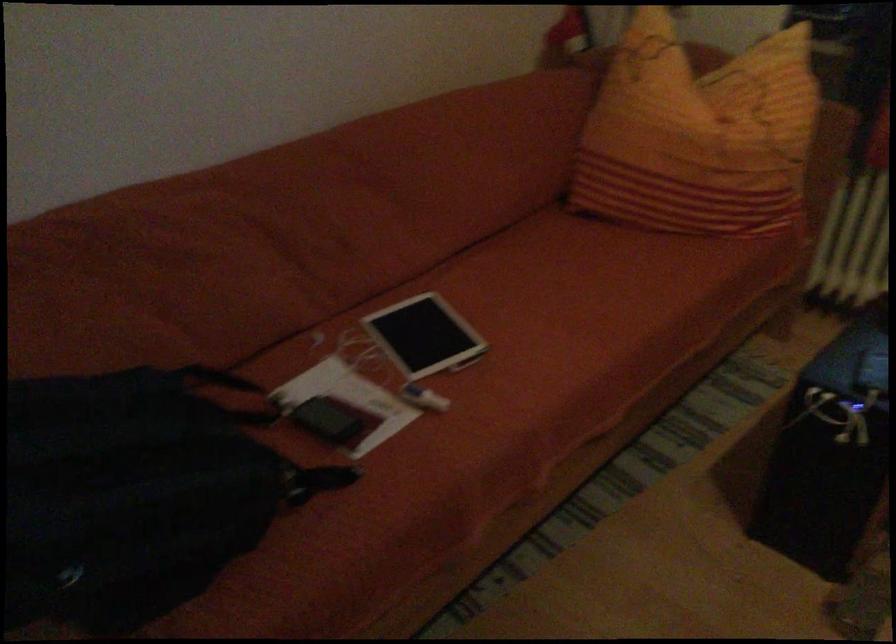
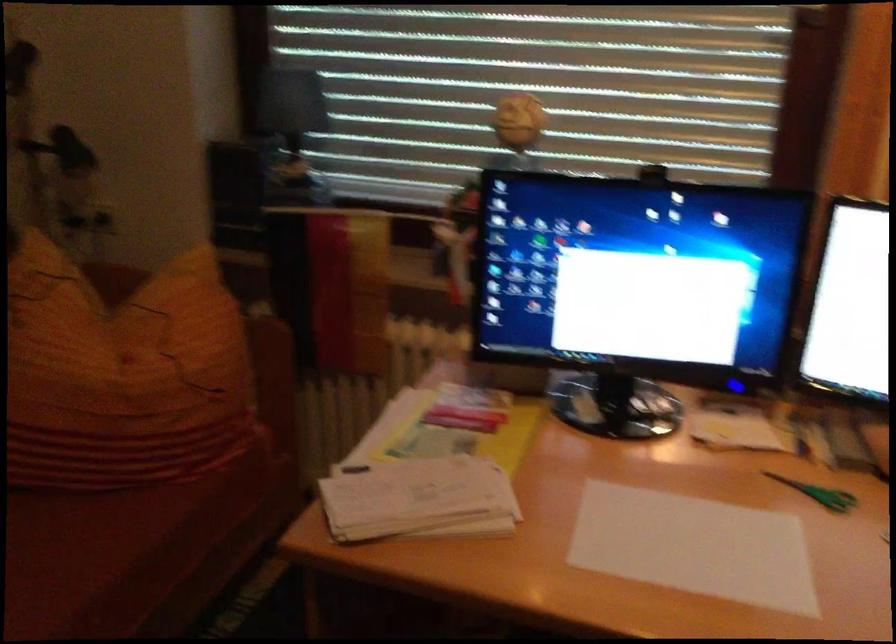
Question: The images are taken continuously from a first-person perspective. In which direction is your viewpoint rotating?

Choices:
 (A) Left
 (B) Right
 (C) Up
 (D) Down

Answer: (B)